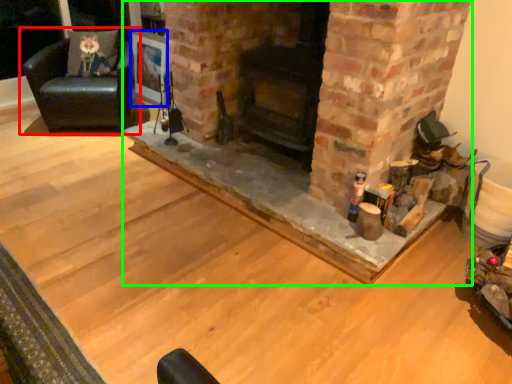
Question: Based on their relative distances, which object is farther from chair (highlighted by a red box)? Choose from picture frame (highlighted by a blue box) and fireplace (highlighted by a green box).

Choices:
 (A) picture frame
 (B) fireplace

Answer: (B)